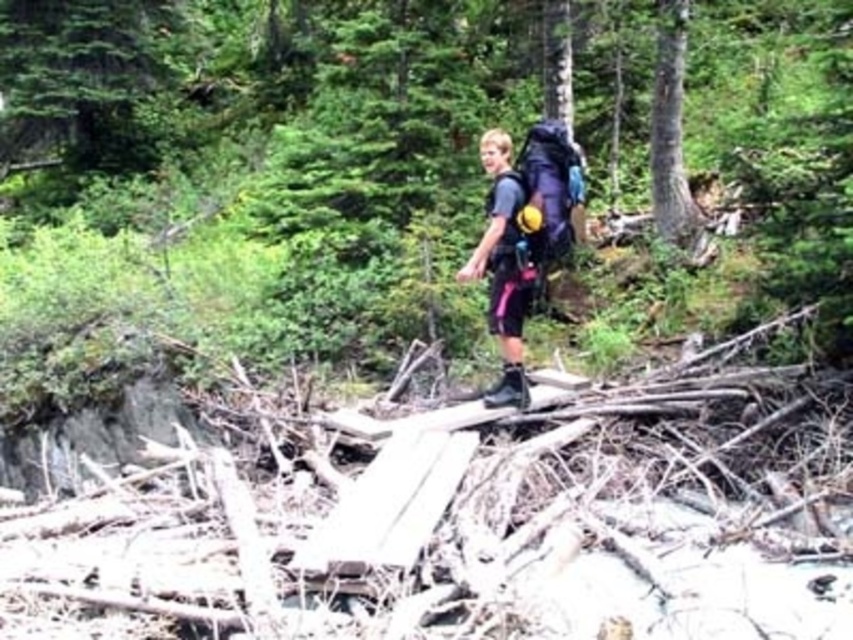
The hiker is at point (503, 268). What object is located at that point?

The dark gray fabric backpack at center is located at point (503, 268).

The dark gray fabric backpack at center is 6.70 meters away from the hiker. If the hiker wants to retrieve it without moving, is the distance too far to reach?

The dark gray fabric backpack at center is 6.70 meters away from the hiker, which is too far to reach without moving closer. The hiker must move towards the backpack to retrieve it.